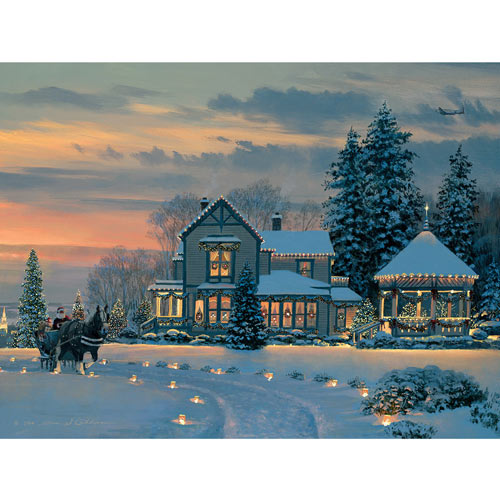
Find the location of `wreath`. wreath is located at coordinates tap(200, 314), tap(213, 266), tap(226, 264), tap(303, 270), tap(266, 313), tap(286, 312), tap(313, 313), tap(341, 317).